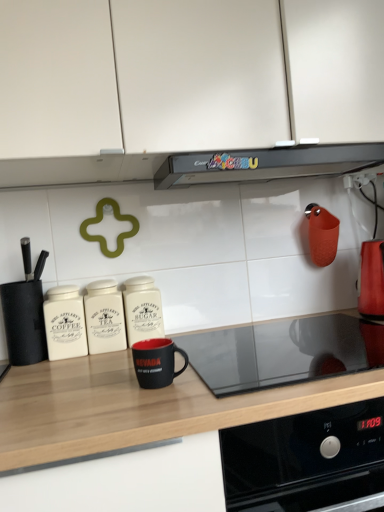
Question: Does black matte mug at center, placed as the 4th kitchen appliance when sorted from left to right, have a lesser height compared to white matte cabinet at upper center?

Choices:
 (A) yes
 (B) no

Answer: (A)

Question: Is black matte mug at center, placed as the 4th kitchen appliance when sorted from left to right, thinner than white matte cabinet at upper center?

Choices:
 (A) no
 (B) yes

Answer: (B)

Question: Is black matte mug at center, placed as the 4th kitchen appliance when sorted from left to right, behind white matte cabinet at upper center?

Choices:
 (A) yes
 (B) no

Answer: (A)

Question: Considering the relative sizes of black matte mug at center, placed as the 4th kitchen appliance when sorted from left to right, and white matte cabinet at upper center in the image provided, is black matte mug at center, placed as the 4th kitchen appliance when sorted from left to right, smaller than white matte cabinet at upper center?

Choices:
 (A) yes
 (B) no

Answer: (A)

Question: Can you confirm if black matte mug at center, the third kitchen appliance in the right-to-left sequence, is wider than white matte cabinet at upper center?

Choices:
 (A) no
 (B) yes

Answer: (A)

Question: From a real-world perspective, is black matte mug at center, placed as the 4th kitchen appliance when sorted from left to right, physically below white matte cabinet at upper center?

Choices:
 (A) no
 (B) yes

Answer: (B)

Question: Is black matte countertop at center at the right side of white ceramic canister at center, the third kitchen appliance viewed from the left?

Choices:
 (A) yes
 (B) no

Answer: (A)

Question: Is black matte countertop at center smaller than white ceramic canister at center, the third kitchen appliance viewed from the left?

Choices:
 (A) yes
 (B) no

Answer: (B)

Question: From the image's perspective, would you say black matte countertop at center is shown under white ceramic canister at center, which is counted as the fourth kitchen appliance, starting from the right?

Choices:
 (A) yes
 (B) no

Answer: (A)

Question: Is black matte countertop at center aimed at white ceramic canister at center, the third kitchen appliance viewed from the left?

Choices:
 (A) no
 (B) yes

Answer: (A)

Question: From the image's perspective, is black matte countertop at center on white ceramic canister at center, which is counted as the fourth kitchen appliance, starting from the right?

Choices:
 (A) yes
 (B) no

Answer: (B)

Question: Is black matte countertop at center directly adjacent to white ceramic canister at center, the third kitchen appliance viewed from the left?

Choices:
 (A) no
 (B) yes

Answer: (A)

Question: Considering the relative sizes of white matte cabinet at upper center and shiny metallic kettle at right, the 6th kitchen appliance positioned from the left, in the image provided, is white matte cabinet at upper center smaller than shiny metallic kettle at right, the 6th kitchen appliance positioned from the left,?

Choices:
 (A) no
 (B) yes

Answer: (A)